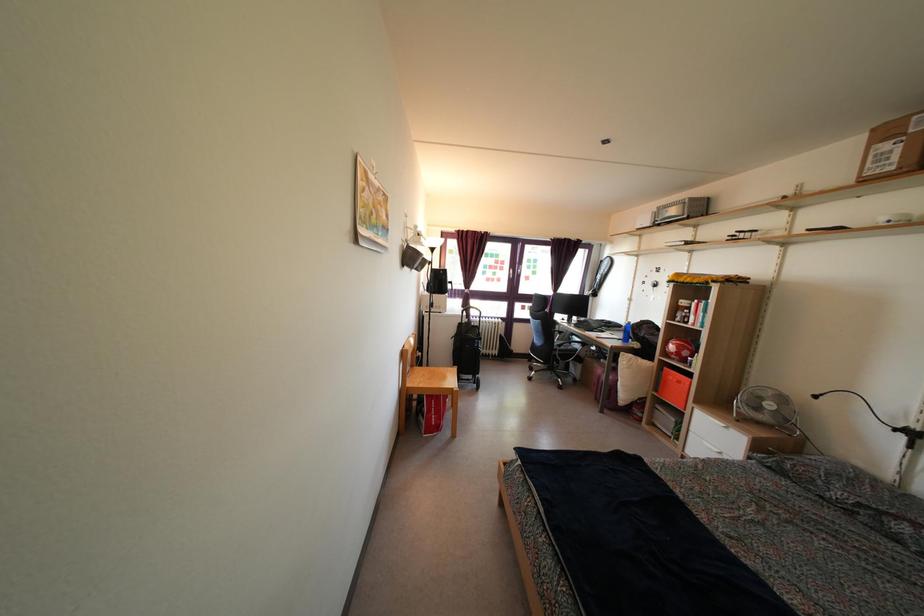
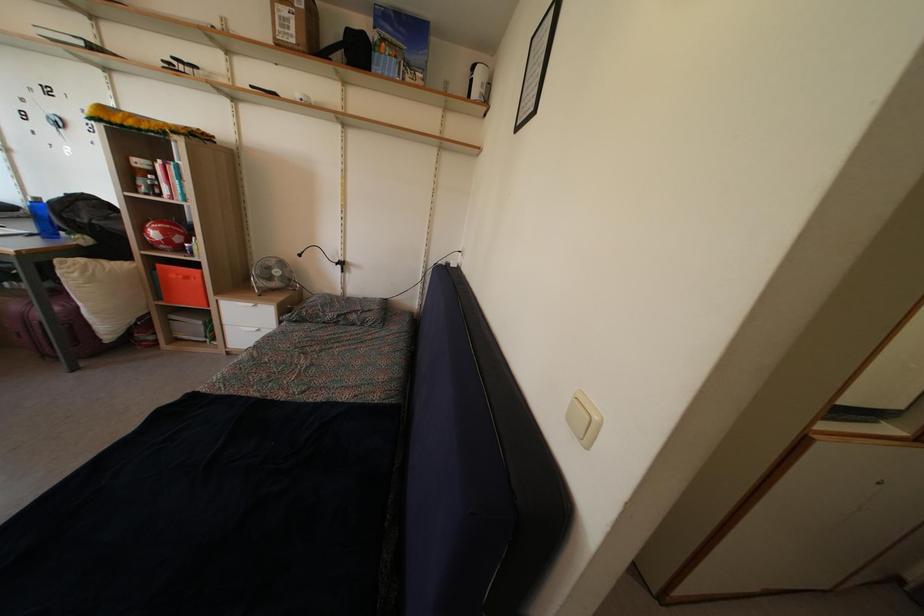
Where in the second image is the point corresponding to [772,414] from the first image?

(280, 281)